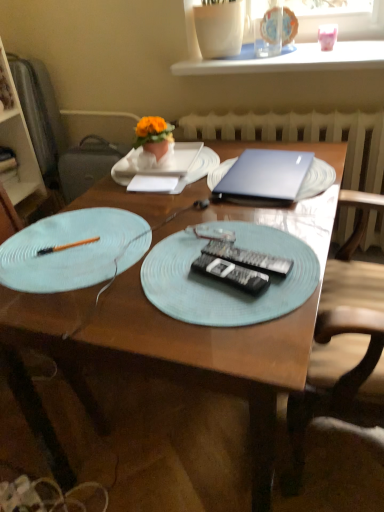
You are a GUI agent. You are given a task and a screenshot of the screen. Output one action in this format:
    pyautogui.click(x=<x>, y=<y>)
    Task: Click on the vacant area that lies in front of white paper at center
    
    Given the screenshot: What is the action you would take?
    pyautogui.click(x=171, y=211)